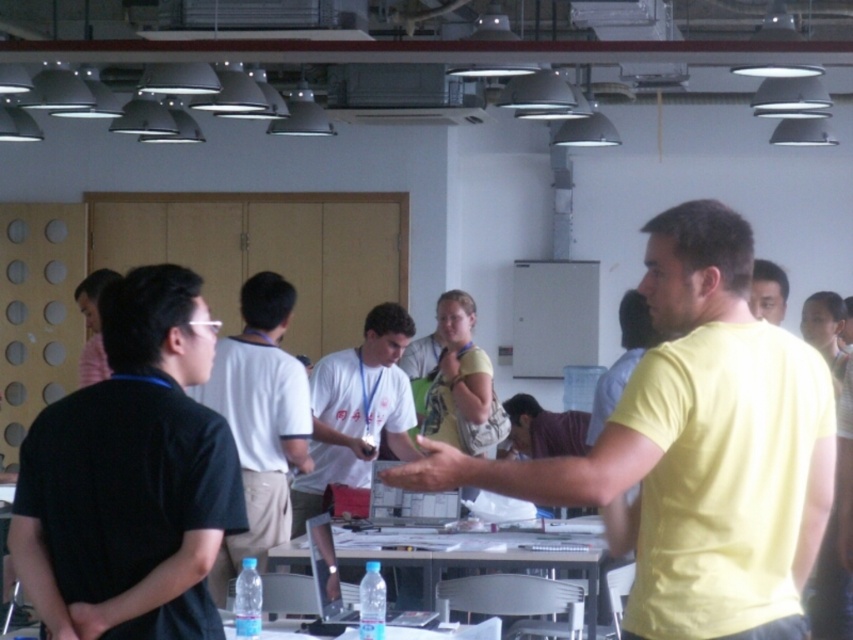
You are organizing a photoshoot and need to place two shirts on a table. The yellow matte shirt at center and the black cotton shirt at center must be positioned so that the larger one is visible. Which shirt should be placed in front to ensure visibility?

The yellow matte shirt at center should be placed in front because it has a larger size than the black cotton shirt at center, making it more visible when positioned forward.

From the picture: You are standing in the office and need to reach both the point at coordinates (697,502) and the point at coordinates (164,572). Which point should you approach first if you want to reach the one closer to you first?

You should approach point (697,502) first because it is closer to you than point (164,572) according to the description.